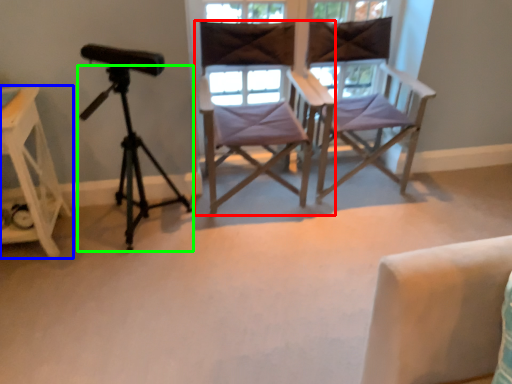
Question: Based on their relative distances, which object is farther from chair (highlighted by a red box)? Choose from furniture (highlighted by a blue box) and tripod (highlighted by a green box).

Choices:
 (A) furniture
 (B) tripod

Answer: (A)